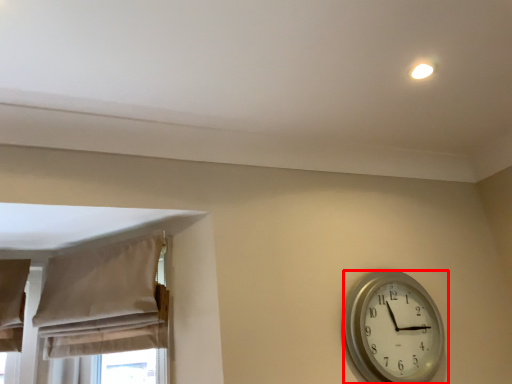
Question: Where is wall clock (annotated by the red box) located in relation to curtain in the image?

Choices:
 (A) left
 (B) right

Answer: (B)